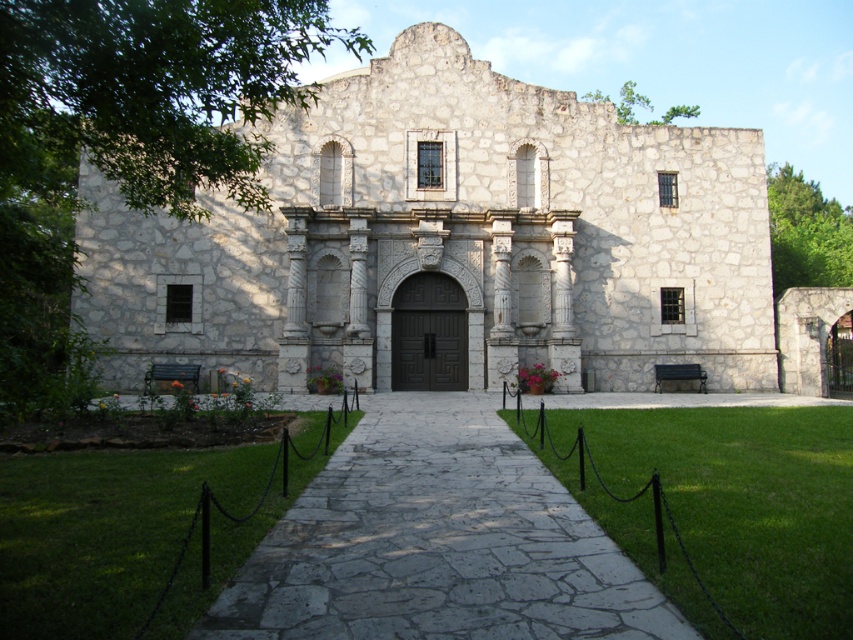
Question: Which is nearer to the dark brown wood door at center?

Choices:
 (A) stone textured church at center
 (B) gray stone pathway at center

Answer: (A)

Question: Which is farther from the dark brown wood door at center?

Choices:
 (A) gray stone pathway at center
 (B) stone textured church at center

Answer: (A)

Question: Is stone textured church at center to the right of gray stone pathway at center from the viewer's perspective?

Choices:
 (A) no
 (B) yes

Answer: (A)

Question: Is gray stone pathway at center below dark brown wood door at center?

Choices:
 (A) yes
 (B) no

Answer: (A)

Question: Which object is the closest to the dark brown wood door at center?

Choices:
 (A) stone textured church at center
 (B) gray stone pathway at center

Answer: (A)

Question: Does stone textured church at center have a smaller size compared to dark brown wood door at center?

Choices:
 (A) no
 (B) yes

Answer: (A)